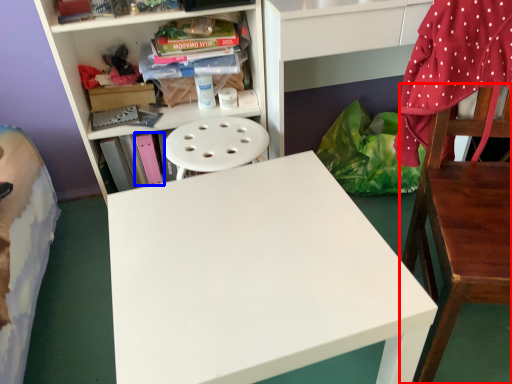
Question: Among these objects, which one is nearest to the camera, chair (highlighted by a red box) or book (highlighted by a blue box)?

Choices:
 (A) chair
 (B) book

Answer: (A)